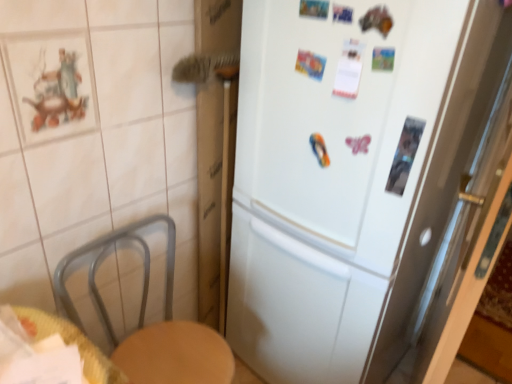
Question: In terms of width, does white matte refrigerator at center look wider or thinner when compared to woven wood table at lower left?

Choices:
 (A) thin
 (B) wide

Answer: (B)

Question: Relative to woven wood table at lower left, is white matte refrigerator at center in front or behind?

Choices:
 (A) front
 (B) behind

Answer: (B)

Question: Is white matte refrigerator at center bigger or smaller than woven wood table at lower left?

Choices:
 (A) big
 (B) small

Answer: (A)

Question: Is woven wood table at lower left in front of or behind white matte refrigerator at center in the image?

Choices:
 (A) behind
 (B) front

Answer: (B)

Question: From their relative heights in the image, would you say woven wood table at lower left is taller or shorter than white matte refrigerator at center?

Choices:
 (A) short
 (B) tall

Answer: (A)

Question: Is woven wood table at lower left spatially inside white matte refrigerator at center, or outside of it?

Choices:
 (A) outside
 (B) inside

Answer: (A)

Question: In terms of width, does woven wood table at lower left look wider or thinner when compared to white matte refrigerator at center?

Choices:
 (A) wide
 (B) thin

Answer: (B)